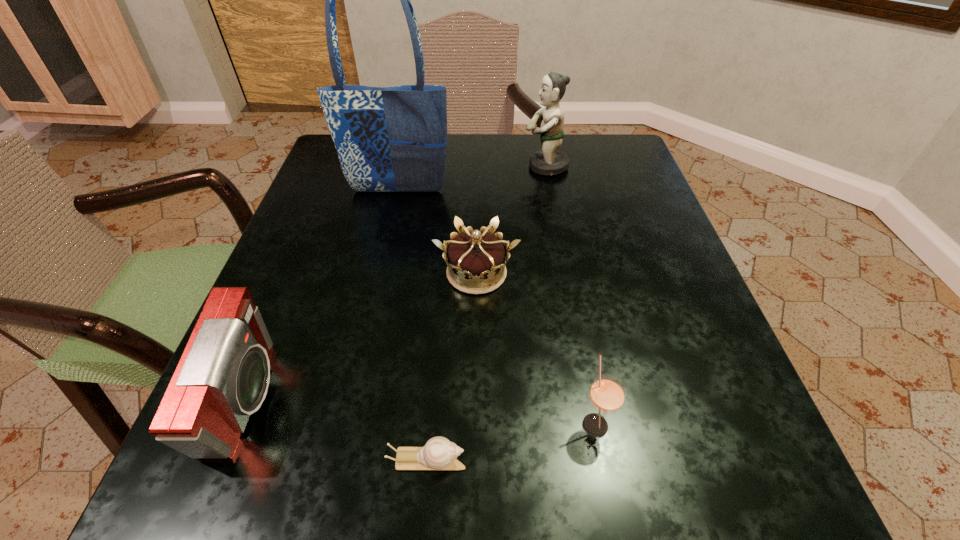
At what (x,y) coordinates should I click in order to perform the action: click on shopping bag. Please return your answer as a coordinate pair (x, y). Image resolution: width=960 pixels, height=540 pixels. Looking at the image, I should click on (389, 139).

Where is `the fifth nearest object`? the fifth nearest object is located at coordinates (389, 139).

Identify the location of the farthest object. (549, 161).

Identify the location of the second tallest object. The image size is (960, 540). (549, 161).

The image size is (960, 540). Find the location of `straw`. straw is located at coordinates (607, 394).

Image resolution: width=960 pixels, height=540 pixels. In order to click on camera in this screenshot , I will do `click(223, 375)`.

Locate an element on the screen. The height and width of the screenshot is (540, 960). the fourth nearest object is located at coordinates (475, 261).

Find the location of `the fifth tallest object`. the fifth tallest object is located at coordinates [x=475, y=261].

Find the location of a particular element. This screenshot has height=540, width=960. escargot is located at coordinates (439, 453).

You are a GUI agent. You are given a task and a screenshot of the screen. Output one action in this format:
    pyautogui.click(x=<x>, y=<y>)
    Task: Click on the free space located 0.300m on the front-facing side of the tallest object
    
    Given the screenshot: What is the action you would take?
    pyautogui.click(x=372, y=306)